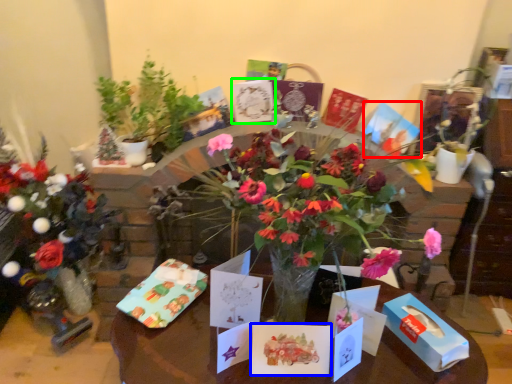
Question: Which is nearer to the birthday card (highlighted by a red box)? birthday card (highlighted by a blue box) or birthday card (highlighted by a green box).

Choices:
 (A) birthday card
 (B) birthday card

Answer: (B)